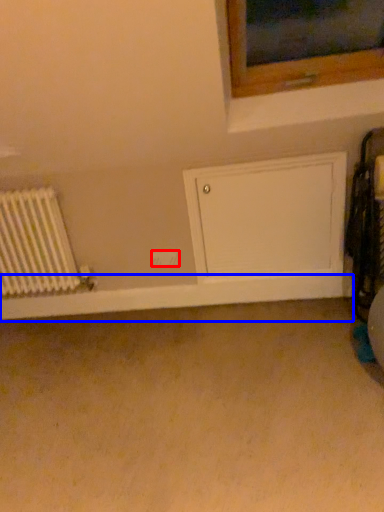
Question: Which object appears farthest to the camera in this image, electric outlet (highlighted by a red box) or window sill (highlighted by a blue box)?

Choices:
 (A) electric outlet
 (B) window sill

Answer: (A)